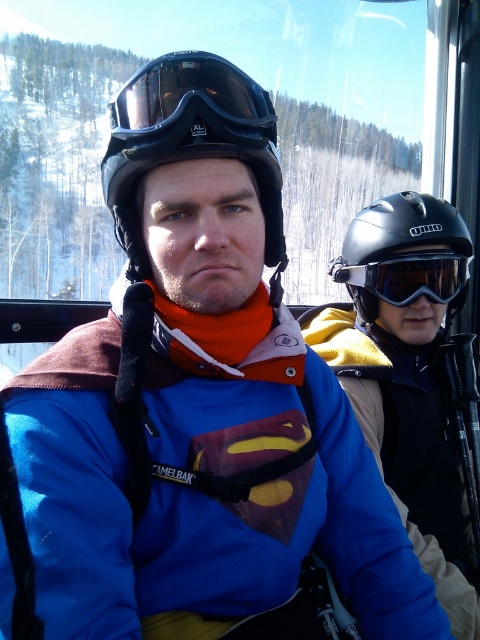
Is black matte ski goggles at upper center positioned at the back of black matte goggles at center?

That is False.

Between black matte ski goggles at upper center and black matte goggles at center, which one has less height?

With less height is black matte goggles at center.

Is point (163, 140) closer to viewer compared to point (356, 278)?

Yes, it is.

Identify the location of black matte ski goggles at upper center. Image resolution: width=480 pixels, height=640 pixels. (190, 108).

Does black matte helmet at right appear on the left side of black matte goggles at center?

Incorrect, black matte helmet at right is not on the left side of black matte goggles at center.

Which is above, black matte helmet at right or black matte goggles at center?

Positioned higher is black matte helmet at right.

Is point (370, 280) positioned behind point (440, 282)?

Yes, point (370, 280) is behind point (440, 282).

This screenshot has width=480, height=640. Find the location of `black matte helmet at right`. black matte helmet at right is located at coordinates (405, 256).

Is black matte helmet at right smaller than black matte ski goggles at upper center?

No, black matte helmet at right is not smaller than black matte ski goggles at upper center.

Where is `black matte helmet at right`? The width and height of the screenshot is (480, 640). black matte helmet at right is located at coordinates (405, 256).